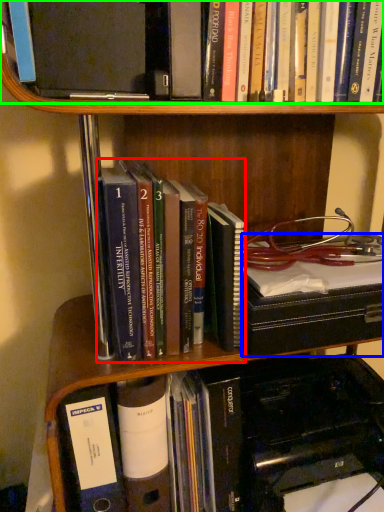
Question: Estimate the real-world distances between objects in this image. Which object is farther from book (highlighted by a red box), book (highlighted by a blue box) or book (highlighted by a green box)?

Choices:
 (A) book
 (B) book

Answer: (B)